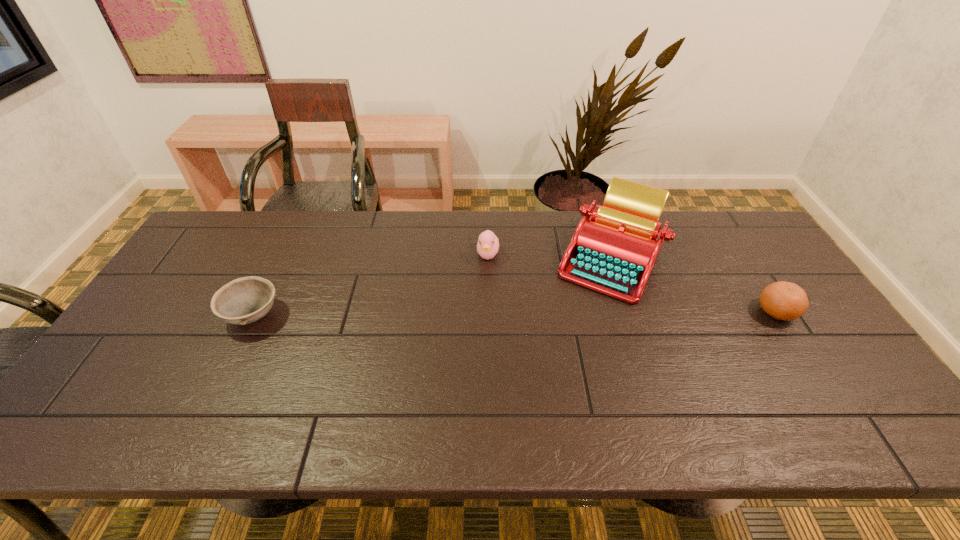
Locate an element on the screen. The image size is (960, 540). bowl is located at coordinates (246, 300).

Identify the location of the shortest object. The width and height of the screenshot is (960, 540). (246, 300).

At what (x,y) coordinates should I click in order to perform the action: click on clementine. Please return your answer as a coordinate pair (x, y). This screenshot has height=540, width=960. Looking at the image, I should click on (782, 300).

The width and height of the screenshot is (960, 540). What are the coordinates of `the second object from left to right` in the screenshot? It's located at (488, 244).

Identify the location of typewriter. (613, 250).

Identify the location of the second object from right to left. (613, 250).

The height and width of the screenshot is (540, 960). Find the location of `blank space located on the left of the shortest object`. blank space located on the left of the shortest object is located at coordinates (152, 315).

What are the coordinates of `blank area located 0.350m on the left of the clementine` in the screenshot? It's located at (630, 312).

Image resolution: width=960 pixels, height=540 pixels. I want to click on free space located on the front-facing side of the third object from right to left, so click(x=488, y=310).

Find the location of a particular element. The height and width of the screenshot is (540, 960). free space located 0.320m on the front-facing side of the third object from right to left is located at coordinates (487, 351).